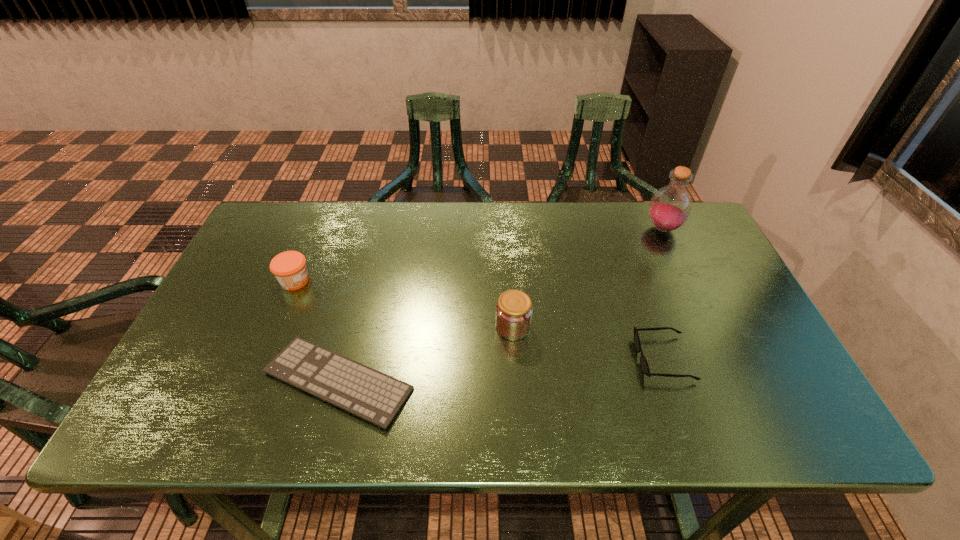
The height and width of the screenshot is (540, 960). Find the location of `the tallest object`. the tallest object is located at coordinates (670, 207).

Identify the location of bottle. Image resolution: width=960 pixels, height=540 pixels. (670, 207).

You are a GUI agent. You are given a task and a screenshot of the screen. Output one action in this format:
    pyautogui.click(x=<x>, y=<y>)
    Task: Click on the fourth shortest object
    Image resolution: width=960 pixels, height=540 pixels.
    Given the screenshot: What is the action you would take?
    pyautogui.click(x=514, y=309)

Image resolution: width=960 pixels, height=540 pixels. In order to click on the nearer jam in this screenshot , I will do `click(514, 309)`.

This screenshot has height=540, width=960. Find the location of `the shorter jam`. the shorter jam is located at coordinates (289, 267).

Identify the location of the left jam. (289, 267).

I want to click on sunglasses, so pyautogui.click(x=643, y=362).

This screenshot has width=960, height=540. I want to click on the fourth object from left to right, so click(x=643, y=362).

In order to click on the shortest object in this screenshot , I will do `click(376, 397)`.

This screenshot has height=540, width=960. I want to click on vacant space located 0.340m on the front of the tallest object, so click(x=709, y=329).